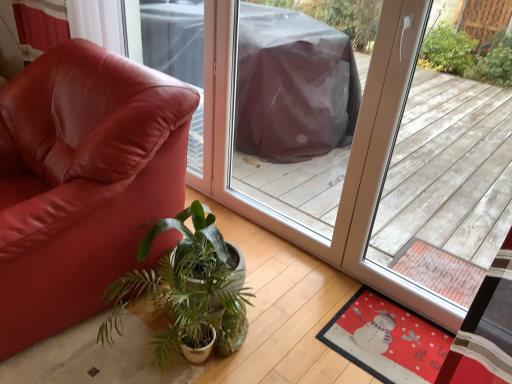
The image size is (512, 384). I want to click on free space to the left of green leafy plant at center, so pos(80,349).